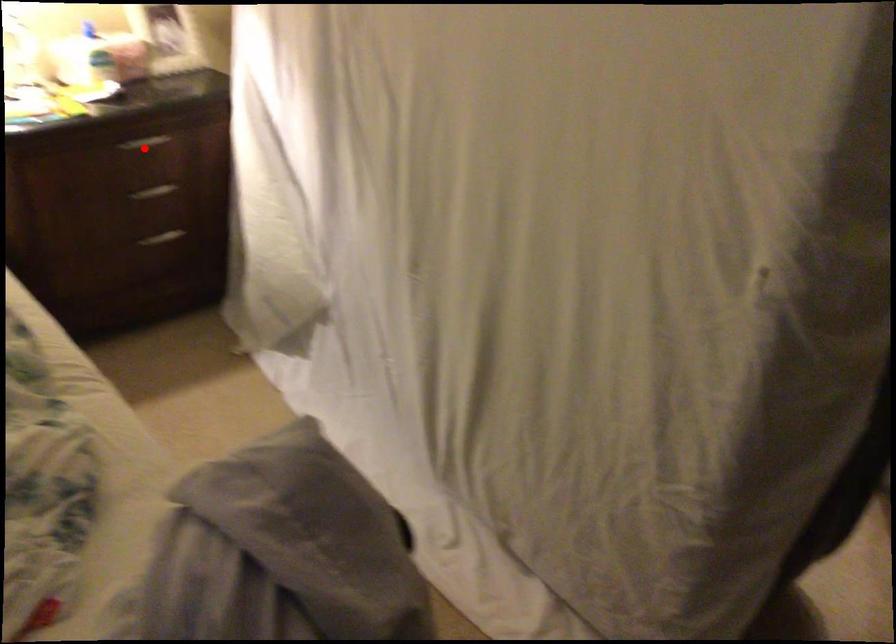
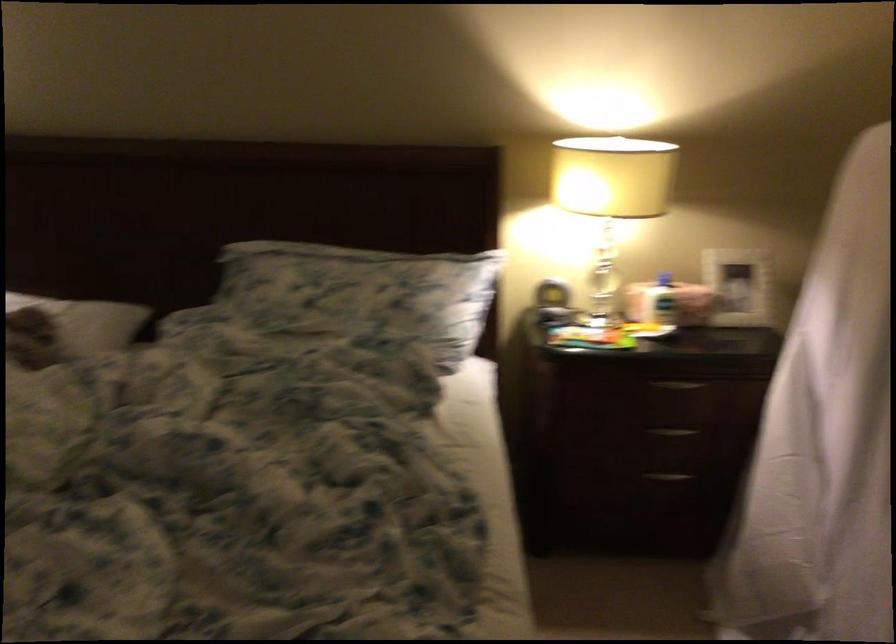
Where in the second image is the point corresponding to the highlighted location from the first image?

(679, 384)